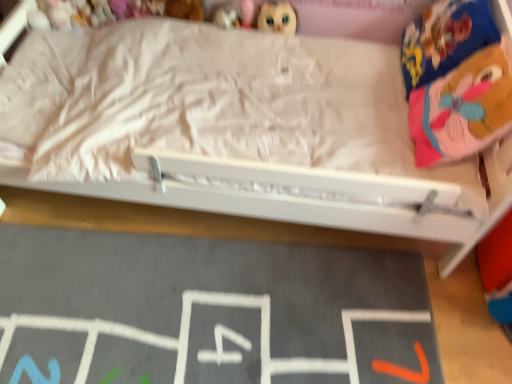
Question: Considering the relative sizes of matte plastic toy at upper center, the second toy when ordered from right to left, and plush toy at upper left, the 1th toy from the left, in the image provided, is matte plastic toy at upper center, the second toy when ordered from right to left, shorter than plush toy at upper left, the 1th toy from the left,?

Choices:
 (A) yes
 (B) no

Answer: (A)

Question: Considering the relative positions of matte plastic toy at upper center, acting as the third toy starting from the left, and plush toy at upper left, which is the 4th toy in right-to-left order, in the image provided, is matte plastic toy at upper center, acting as the third toy starting from the left, to the left of plush toy at upper left, which is the 4th toy in right-to-left order, from the viewer's perspective?

Choices:
 (A) no
 (B) yes

Answer: (A)

Question: Would you consider matte plastic toy at upper center, acting as the third toy starting from the left, to be distant from plush toy at upper left, which is the 4th toy in right-to-left order?

Choices:
 (A) no
 (B) yes

Answer: (A)

Question: From the image's perspective, is matte plastic toy at upper center, acting as the third toy starting from the left, under plush toy at upper left, the 1th toy from the left?

Choices:
 (A) no
 (B) yes

Answer: (B)

Question: Is matte plastic toy at upper center, acting as the third toy starting from the left, bigger than plush toy at upper left, which is the 4th toy in right-to-left order?

Choices:
 (A) yes
 (B) no

Answer: (B)

Question: Looking at the image, does pink fabric pillow at upper right seem bigger or smaller compared to matte plastic toy at upper center, acting as the third toy starting from the left?

Choices:
 (A) small
 (B) big

Answer: (B)

Question: Considering the positions of point (430, 48) and point (231, 21), is point (430, 48) closer or farther from the camera than point (231, 21)?

Choices:
 (A) closer
 (B) farther

Answer: (A)

Question: From the image's perspective, is pink fabric pillow at upper right above or below matte plastic toy at upper center, the second toy when ordered from right to left?

Choices:
 (A) above
 (B) below

Answer: (B)

Question: Looking at their shapes, would you say pink fabric pillow at upper right is wider or thinner than matte plastic toy at upper center, acting as the third toy starting from the left?

Choices:
 (A) thin
 (B) wide

Answer: (B)

Question: Considering the positions of point (176, 8) and point (375, 261), is point (176, 8) closer or farther from the camera than point (375, 261)?

Choices:
 (A) closer
 (B) farther

Answer: (B)

Question: Relative to black chalkboard at lower center, is soft plush bear at upper center, the third toy when ordered from right to left, in front or behind?

Choices:
 (A) front
 (B) behind

Answer: (B)

Question: From the image's perspective, is soft plush bear at upper center, the third toy when ordered from right to left, located above or below black chalkboard at lower center?

Choices:
 (A) below
 (B) above

Answer: (B)

Question: From a real-world perspective, relative to black chalkboard at lower center, is soft plush bear at upper center, the second toy in the left-to-right sequence, vertically above or below?

Choices:
 (A) above
 (B) below

Answer: (A)

Question: From a real-world perspective, is matte plastic doll at upper center, positioned as the 4th toy in left-to-right order, physically located above or below plush toy at upper left, which is the 4th toy in right-to-left order?

Choices:
 (A) below
 (B) above

Answer: (B)

Question: In the image, is matte plastic doll at upper center, the first toy positioned from the right, on the left side or the right side of plush toy at upper left, which is the 4th toy in right-to-left order?

Choices:
 (A) right
 (B) left

Answer: (A)